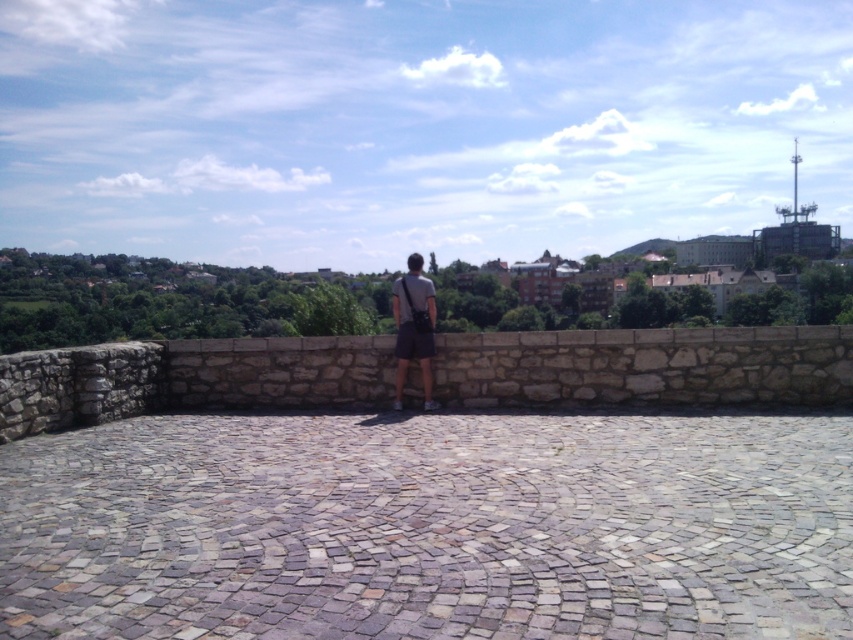
Is point (149, 358) closer to viewer compared to point (418, 296)?

No, it is not.

Can you confirm if stone at center is positioned above dark gray fabric bag at center?

Incorrect, stone at center is not positioned above dark gray fabric bag at center.

What do you see at coordinates (646, 368) in the screenshot?
I see `stone at center` at bounding box center [646, 368].

In order to click on stone at center in this screenshot , I will do `click(646, 368)`.